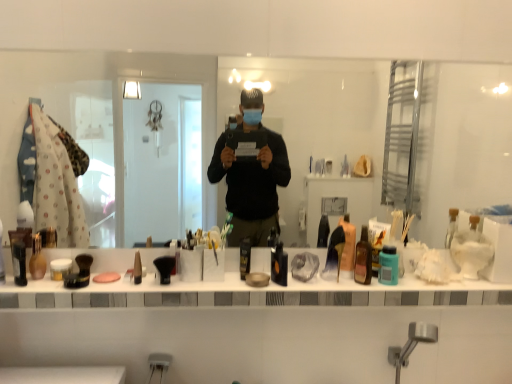
I want to click on teal plastic container at center, acting as the first toiletry starting from the right, so click(388, 266).

Measure the distance between point (368, 227) and camera.

Point (368, 227) and camera are 4.52 feet apart from each other.

Identify the location of white matte shaving cream at right. (471, 249).

Find the location of a particular element. matte black shaving brush at left, positioned as the 10th toiletry in right-to-left order is located at coordinates (20, 253).

At what (x,y) coordinates should I click in order to perform the action: click on teal plastic container at center, the 10th toiletry viewed from the left. Please return your answer as a coordinate pair (x, y). The image size is (512, 384). Looking at the image, I should click on (388, 266).

From the image's perspective, does translucent plastic bottle at center, which is counted as the 7th toiletry, starting from the left, appear lower than teal plastic container at center, acting as the first toiletry starting from the right?

No, from the image's perspective, translucent plastic bottle at center, which is counted as the 7th toiletry, starting from the left, is not beneath teal plastic container at center, acting as the first toiletry starting from the right.

Which of these two, translucent plastic bottle at center, which is counted as the 7th toiletry, starting from the left, or teal plastic container at center, the 10th toiletry viewed from the left, stands taller?

With more height is translucent plastic bottle at center, which is counted as the 7th toiletry, starting from the left.

Considering the relative positions of translucent plastic bottle at center, acting as the fourth toiletry starting from the right, and teal plastic container at center, the 10th toiletry viewed from the left, in the image provided, is translucent plastic bottle at center, acting as the fourth toiletry starting from the right, behind teal plastic container at center, the 10th toiletry viewed from the left,?

Yes.

Considering the sizes of objects translucent plastic bottle at center, which is counted as the 7th toiletry, starting from the left, and teal plastic container at center, acting as the first toiletry starting from the right, in the image provided, who is bigger, translucent plastic bottle at center, which is counted as the 7th toiletry, starting from the left, or teal plastic container at center, acting as the first toiletry starting from the right,?

With larger size is translucent plastic bottle at center, which is counted as the 7th toiletry, starting from the left.

Between matte black shaving brush at left, positioned as the 10th toiletry in right-to-left order, and brown glass bottle at right, the eighth toiletry from the left, which one has more height?

brown glass bottle at right, the eighth toiletry from the left, is taller.

Does point (17, 243) come farther from viewer compared to point (371, 258)?

Yes, point (17, 243) is farther from viewer.

In the scene shown: Is brown glass bottle at right, the eighth toiletry from the left, shorter than matte black shaving brush at left, the first toiletry in the left-to-right sequence?

In fact, brown glass bottle at right, the eighth toiletry from the left, may be taller than matte black shaving brush at left, the first toiletry in the left-to-right sequence.

Does brown glass bottle at right, which is the third toiletry from right to left, appear on the left side of matte black shaving brush at left, the first toiletry in the left-to-right sequence?

Incorrect, brown glass bottle at right, which is the third toiletry from right to left, is not on the left side of matte black shaving brush at left, the first toiletry in the left-to-right sequence.

Is brown glass bottle at right, which is the third toiletry from right to left, positioned before matte black shaving brush at left, positioned as the 10th toiletry in right-to-left order?

Yes, the depth of brown glass bottle at right, which is the third toiletry from right to left, is less than that of matte black shaving brush at left, positioned as the 10th toiletry in right-to-left order.

From a real-world perspective, relative to matte black shaving brush at left, the first toiletry in the left-to-right sequence, is brown glass bottle at right, which is the third toiletry from right to left, vertically above or below?

brown glass bottle at right, which is the third toiletry from right to left, is situated higher than matte black shaving brush at left, the first toiletry in the left-to-right sequence, in the real world.

Where is `the 8th toiletry counting from the right side of the matte black shaving brush at left, positioned as the 10th toiletry in right-to-left order`? The image size is (512, 384). the 8th toiletry counting from the right side of the matte black shaving brush at left, positioned as the 10th toiletry in right-to-left order is located at coordinates (377, 241).

In the scene shown: Considering the sizes of objects matte black shaving brush at left, positioned as the 10th toiletry in right-to-left order, and translucent plastic bottle at center, marked as the ninth toiletry in a left-to-right arrangement, in the image provided, who is bigger, matte black shaving brush at left, positioned as the 10th toiletry in right-to-left order, or translucent plastic bottle at center, marked as the ninth toiletry in a left-to-right arrangement,?

With larger size is translucent plastic bottle at center, marked as the ninth toiletry in a left-to-right arrangement.

Is matte black shaving brush at left, the first toiletry in the left-to-right sequence, facing away from translucent plastic bottle at center, which is counted as the second toiletry, starting from the right?

Answer: No, matte black shaving brush at left, the first toiletry in the left-to-right sequence,'s orientation is not away from translucent plastic bottle at center, which is counted as the second toiletry, starting from the right.

From the image's perspective, between matte black shaving brush at left, positioned as the 10th toiletry in right-to-left order, and translucent plastic bottle at center, marked as the ninth toiletry in a left-to-right arrangement, who is located below?

matte black shaving brush at left, positioned as the 10th toiletry in right-to-left order, appears lower in the image.

From a real-world perspective, which object stands above the other?

From a 3D spatial view, brown glass bottle at right, the eighth toiletry from the left, is above.

How much distance is there between black glossy bottle at center, positioned as the 5th toiletry in right-to-left order, and brown glass bottle at right, which is the third toiletry from right to left?

black glossy bottle at center, positioned as the 5th toiletry in right-to-left order, is 9.89 inches from brown glass bottle at right, which is the third toiletry from right to left.

Is black glossy bottle at center, marked as the 6th toiletry in a left-to-right arrangement, far from brown glass bottle at right, the eighth toiletry from the left?

No, there isn't a large distance between black glossy bottle at center, marked as the 6th toiletry in a left-to-right arrangement, and brown glass bottle at right, the eighth toiletry from the left.

The height and width of the screenshot is (384, 512). I want to click on toiletry in front of the brown glass bottle at right, which is the third toiletry from right to left, so click(x=279, y=265).

Locate an element on the screen. The height and width of the screenshot is (384, 512). toiletry behind the translucent plastic bottle at center, which is counted as the 7th toiletry, starting from the left is located at coordinates (377, 241).

From a real-world perspective, is translucent plastic bottle at center, which is counted as the second toiletry, starting from the right, below translucent plastic bottle at center, acting as the fourth toiletry starting from the right?

No, from a real-world perspective, translucent plastic bottle at center, which is counted as the second toiletry, starting from the right, is not under translucent plastic bottle at center, acting as the fourth toiletry starting from the right.

Which of these two, translucent plastic bottle at center, marked as the ninth toiletry in a left-to-right arrangement, or translucent plastic bottle at center, acting as the fourth toiletry starting from the right, is smaller?

translucent plastic bottle at center, acting as the fourth toiletry starting from the right.

Are brown glass bottle at right, the eighth toiletry from the left, and translucent plastic bottle at center, which is counted as the second toiletry, starting from the right, making contact?

Yes, brown glass bottle at right, the eighth toiletry from the left, is right next to translucent plastic bottle at center, which is counted as the second toiletry, starting from the right, and making contact.

From a real-world perspective, is brown glass bottle at right, the eighth toiletry from the left, positioned over translucent plastic bottle at center, which is counted as the second toiletry, starting from the right, based on gravity?

No, from a real-world perspective, brown glass bottle at right, the eighth toiletry from the left, is not above translucent plastic bottle at center, which is counted as the second toiletry, starting from the right.

Does brown glass bottle at right, which is the third toiletry from right to left, have a smaller size compared to translucent plastic bottle at center, marked as the ninth toiletry in a left-to-right arrangement?

Yes.

Is brown glass bottle at right, the eighth toiletry from the left, taller than translucent plastic bottle at center, marked as the ninth toiletry in a left-to-right arrangement?

Yes.

This screenshot has height=384, width=512. What are the coordinates of `the 3rd toiletry to the right of the translucent plastic bottle at center, acting as the fourth toiletry starting from the right, counting from the anchor's position` in the screenshot? It's located at (388, 266).

Find the location of a particular element. This screenshot has height=384, width=512. the 2nd toiletry below the brown glass bottle at right, which is the third toiletry from right to left (from a real-world perspective) is located at coordinates (20, 253).

In the scene shown: When comparing their distances from white matte shaving cream at right, does matte black brush at center, positioned as the seventh toiletry in right-to-left order, or black glossy bottle at center, marked as the 6th toiletry in a left-to-right arrangement, seem further?

matte black brush at center, positioned as the seventh toiletry in right-to-left order.

Considering their positions, is white matte shaving cream at right positioned closer to matte black brush at center, acting as the 4th toiletry starting from the left, than pink matte soap at center?

Based on the image, pink matte soap at center appears to be nearer to matte black brush at center, acting as the 4th toiletry starting from the left.

Which object lies nearer to the anchor point brown glass bottle at right, which is the third toiletry from right to left, matte black shaving brush at left, the first toiletry in the left-to-right sequence, or teal plastic container at center, the 10th toiletry viewed from the left?

teal plastic container at center, the 10th toiletry viewed from the left, is closer to brown glass bottle at right, which is the third toiletry from right to left.

When comparing their distances from matte black shaving brush at left, positioned as the 10th toiletry in right-to-left order, does matte black brush at center, positioned as the seventh toiletry in right-to-left order, or brown glass bottle at right, which is the third toiletry from right to left, seem closer?

matte black brush at center, positioned as the seventh toiletry in right-to-left order, is closer to matte black shaving brush at left, positioned as the 10th toiletry in right-to-left order.

Considering their positions, is white matte shaving cream at right positioned further to black matte container at center, which ranks as the fifth toiletry in left-to-right order, than translucent plastic bottle at center, acting as the fourth toiletry starting from the right?

white matte shaving cream at right.

Which object lies nearer to the anchor point matte brown vase at left, the 2th toiletry viewed from the left, teal plastic container at center, the 10th toiletry viewed from the left, or translucent plastic bottle at center, which is counted as the second toiletry, starting from the right?

translucent plastic bottle at center, which is counted as the second toiletry, starting from the right, is closer to matte brown vase at left, the 2th toiletry viewed from the left.

Estimate the real-world distances between objects in this image. Which object is further from white matte shaving cream at right, black matte container at center, which ranks as the fifth toiletry in left-to-right order, or teal plastic container at center, acting as the first toiletry starting from the right?

black matte container at center, which ranks as the fifth toiletry in left-to-right order, is further to white matte shaving cream at right.

Looking at the image, which one is located closer to matte black brush at center, acting as the 4th toiletry starting from the left, teal plastic container at center, the 10th toiletry viewed from the left, or black matte container at center, arranged as the sixth toiletry when viewed from the right?

black matte container at center, arranged as the sixth toiletry when viewed from the right, is positioned closer to the anchor matte black brush at center, acting as the 4th toiletry starting from the left.

The width and height of the screenshot is (512, 384). I want to click on mirror between black matte container at center, which ranks as the fifth toiletry in left-to-right order, and brown glass bottle at right, the eighth toiletry from the left, from left to right, so click(326, 117).

Locate an element on the screen. toiletry between black matte container at center, which ranks as the fifth toiletry in left-to-right order, and translucent plastic bottle at center, acting as the fourth toiletry starting from the right, in the horizontal direction is located at coordinates (279, 265).

Image resolution: width=512 pixels, height=384 pixels. Find the location of `mirror located between matte black shaving brush at left, the first toiletry in the left-to-right sequence, and translucent plastic bottle at center, which is counted as the 7th toiletry, starting from the left, in the left-right direction`. mirror located between matte black shaving brush at left, the first toiletry in the left-to-right sequence, and translucent plastic bottle at center, which is counted as the 7th toiletry, starting from the left, in the left-right direction is located at coordinates (326, 117).

Where is `mirror situated between matte brown vase at left, the 2th toiletry viewed from the left, and translucent plastic bottle at center, acting as the fourth toiletry starting from the right, from left to right`? Image resolution: width=512 pixels, height=384 pixels. mirror situated between matte brown vase at left, the 2th toiletry viewed from the left, and translucent plastic bottle at center, acting as the fourth toiletry starting from the right, from left to right is located at coordinates (326, 117).